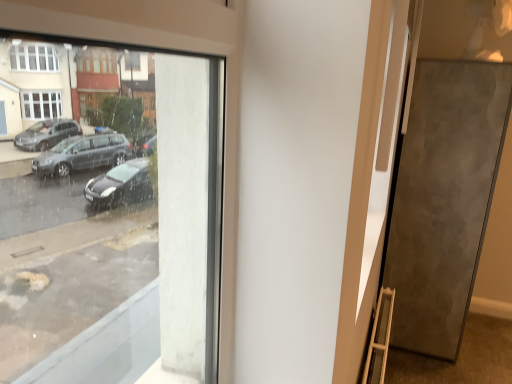
This screenshot has height=384, width=512. Describe the element at coordinates (460, 357) in the screenshot. I see `metallic gray pavement at lower right` at that location.

The height and width of the screenshot is (384, 512). I want to click on wooden ladder at lower right, so click(x=379, y=336).

Is matte gray door at right positioned beyond the bounds of wooden ladder at lower right?

matte gray door at right lies outside wooden ladder at lower right's area.

Is matte gray door at right further to the viewer compared to wooden ladder at lower right?

Yes, it is behind wooden ladder at lower right.

Can you confirm if matte gray door at right is bigger than wooden ladder at lower right?

Indeed, matte gray door at right has a larger size compared to wooden ladder at lower right.

From a real-world perspective, is wooden ladder at lower right under metallic gray pavement at lower right?

No, from a real-world perspective, wooden ladder at lower right is not below metallic gray pavement at lower right.

Is wooden ladder at lower right next to metallic gray pavement at lower right?

No.

Does wooden ladder at lower right come behind metallic gray pavement at lower right?

No.

From the image's perspective, who appears lower, wooden ladder at lower right or metallic gray pavement at lower right?

From the image's view, metallic gray pavement at lower right is below.

Between wooden ladder at lower right and matte gray door at right, which one appears on the right side from the viewer's perspective?

matte gray door at right.

Which is in front, point (393, 305) or point (471, 105)?

The point (471, 105) is in front.

Is metallic gray pavement at lower right positioned before wooden ladder at lower right?

No, it is not.

Does point (489, 346) appear closer or farther from the camera than point (371, 340)?

Point (489, 346) appears to be farther away from the viewer than point (371, 340).

From the image's perspective, is metallic gray pavement at lower right below wooden ladder at lower right?

Indeed, from the image's perspective, metallic gray pavement at lower right is shown beneath wooden ladder at lower right.

You are a GUI agent. You are given a task and a screenshot of the screen. Output one action in this format:
    pyautogui.click(x=<x>, y=<y>)
    Task: Click on the ladder above the metallic gray pavement at lower right (from a real-world perspective)
    This screenshot has width=512, height=384.
    Given the screenshot: What is the action you would take?
    tap(379, 336)

In terms of height, does matte gray door at right look taller or shorter compared to metallic gray pavement at lower right?

matte gray door at right is taller than metallic gray pavement at lower right.

Considering the positions of objects matte gray door at right and metallic gray pavement at lower right in the image provided, who is behind, matte gray door at right or metallic gray pavement at lower right?

matte gray door at right is behind.

From the image's perspective, is matte gray door at right located beneath metallic gray pavement at lower right?

No, from the image's perspective, matte gray door at right is not below metallic gray pavement at lower right.

Based on the photo, is matte gray door at right outside of metallic gray pavement at lower right?

That's correct, matte gray door at right is outside of metallic gray pavement at lower right.

Can we say metallic gray pavement at lower right lies outside matte gray door at right?

Indeed, metallic gray pavement at lower right is completely outside matte gray door at right.

Between metallic gray pavement at lower right and matte gray door at right, which one has smaller width?

A: With smaller width is matte gray door at right.

Looking at the image, does metallic gray pavement at lower right seem bigger or smaller compared to matte gray door at right?

Considering their sizes, metallic gray pavement at lower right takes up less space than matte gray door at right.

In order to click on door on the right side of wooden ladder at lower right in this screenshot , I will do `click(446, 171)`.

Where is `ladder that appears above the metallic gray pavement at lower right (from a real-world perspective)`? This screenshot has width=512, height=384. ladder that appears above the metallic gray pavement at lower right (from a real-world perspective) is located at coordinates (379, 336).

When comparing their distances from metallic gray pavement at lower right, does wooden ladder at lower right or matte gray door at right seem closer?

matte gray door at right.

Looking at this image, looking at the image, which one is located closer to matte gray door at right, metallic gray pavement at lower right or wooden ladder at lower right?

metallic gray pavement at lower right.

Considering their positions, is matte gray door at right positioned further to wooden ladder at lower right than metallic gray pavement at lower right?

metallic gray pavement at lower right lies further to wooden ladder at lower right than the other object.

Looking at the image, which one is located closer to metallic gray pavement at lower right, matte gray door at right or wooden ladder at lower right?

matte gray door at right.

Based on their spatial positions, is wooden ladder at lower right or metallic gray pavement at lower right further from matte gray door at right?

wooden ladder at lower right is further to matte gray door at right.

Looking at the image, which one is located closer to wooden ladder at lower right, metallic gray pavement at lower right or matte gray door at right?

matte gray door at right is closer to wooden ladder at lower right.

Where is `ladder between matte gray door at right and metallic gray pavement at lower right in the vertical direction`? ladder between matte gray door at right and metallic gray pavement at lower right in the vertical direction is located at coordinates (379, 336).